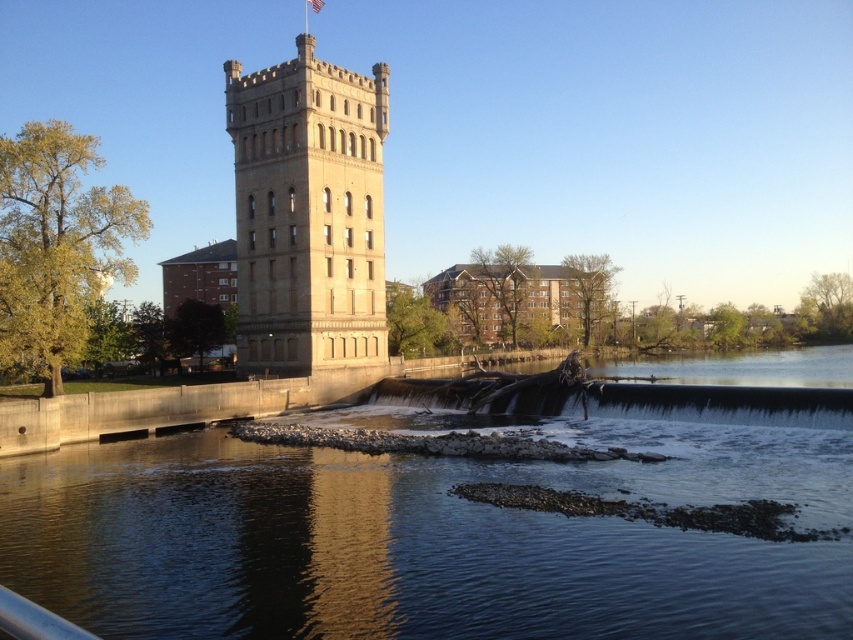
Where is `beige stone tower at center`? This screenshot has height=640, width=853. beige stone tower at center is located at coordinates (308, 212).

Is point (276, 227) positioned before point (0, 621)?

No, (276, 227) is further to viewer.

Does point (358, 252) come behind point (4, 588)?

That is True.

Locate an element on the screen. Image resolution: width=853 pixels, height=640 pixels. beige stone tower at center is located at coordinates (308, 212).